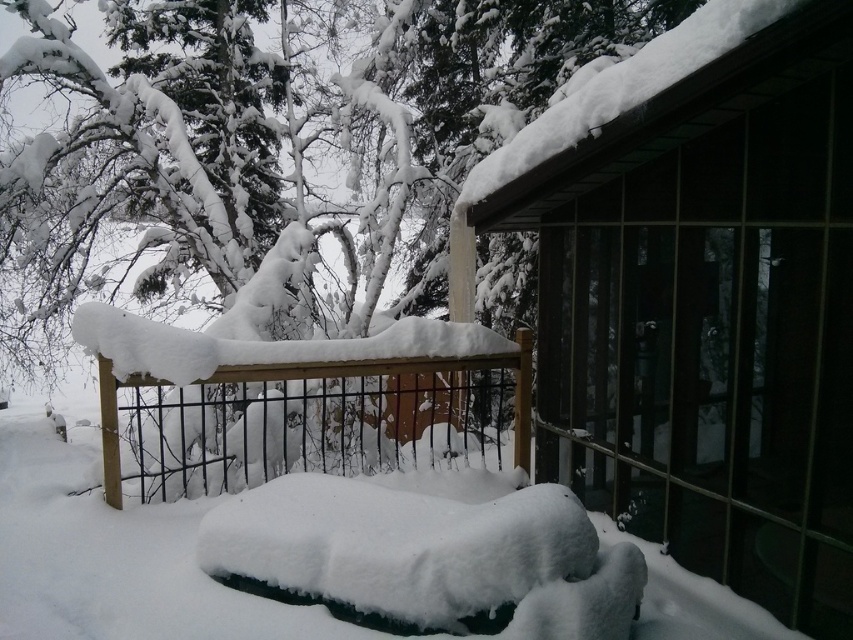
Question: Is wooden cabin at upper right above wooden fence at center?

Choices:
 (A) no
 (B) yes

Answer: (B)

Question: Which point is farther from the camera taking this photo?

Choices:
 (A) (469, 369)
 (B) (517, 188)

Answer: (A)

Question: Among these points, which one is farthest from the camera?

Choices:
 (A) (556, 371)
 (B) (260, 460)

Answer: (A)

Question: Is wooden cabin at upper right below wooden fence at center?

Choices:
 (A) yes
 (B) no

Answer: (B)

Question: Can you confirm if wooden cabin at upper right is positioned to the right of wooden fence at center?

Choices:
 (A) no
 (B) yes

Answer: (B)